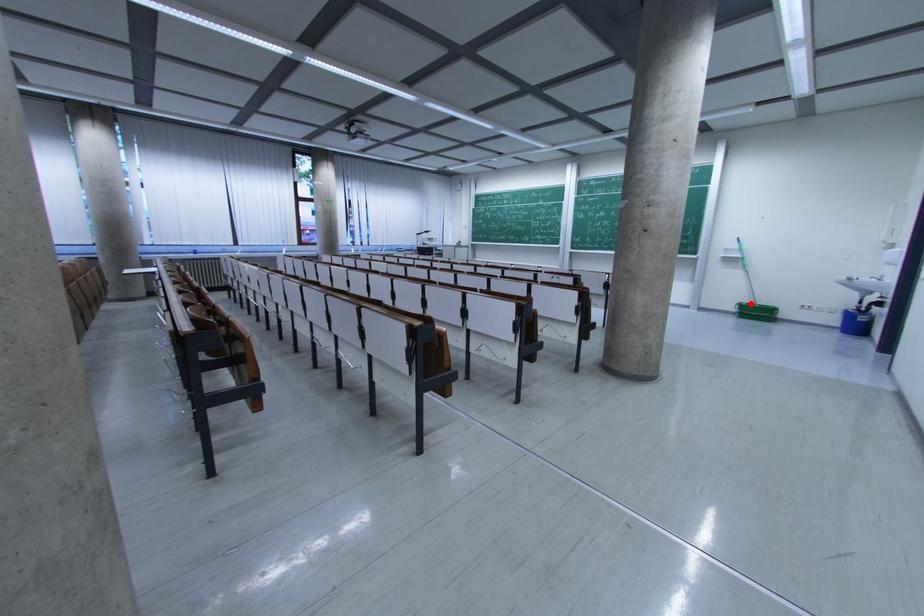
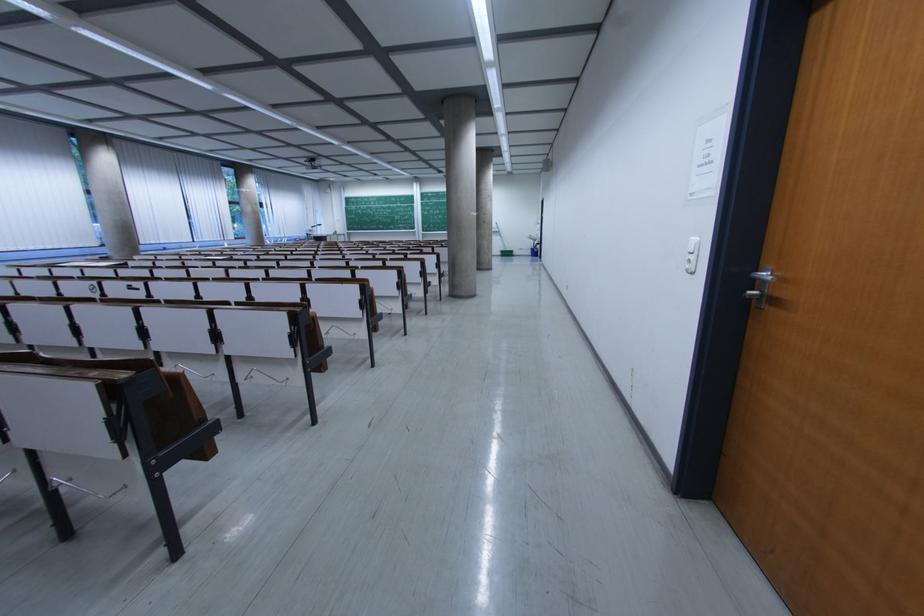
Locate, in the second image, the point that corresponds to the highlighted location in the first image.

(506, 252)